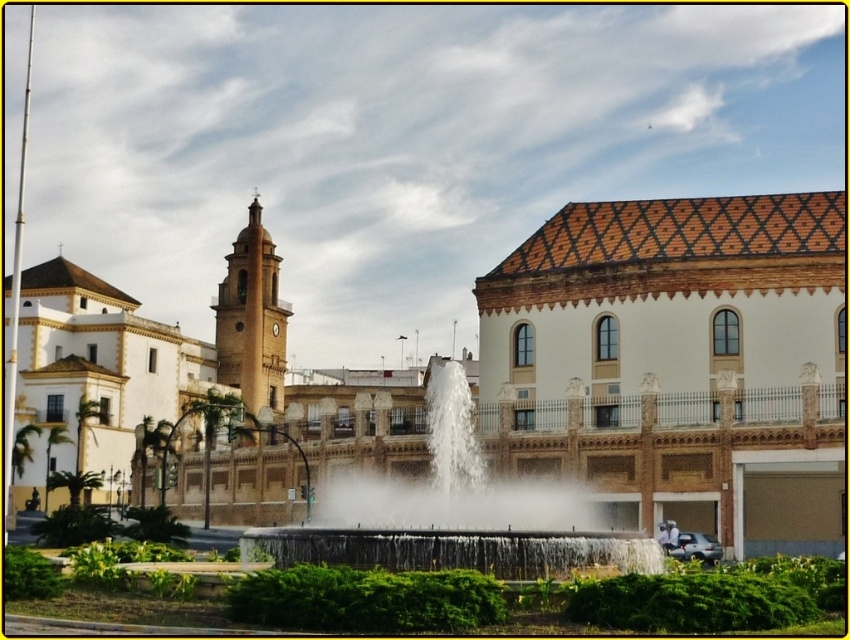
Question: Estimate the real-world distances between objects in this image. Which object is closer to the white stone fountain at center?

Choices:
 (A) white textured fountain at center
 (B) terracotta tiled palace at right

Answer: (B)

Question: Does white textured fountain at center appear over terracotta tiled palace at right?

Choices:
 (A) yes
 (B) no

Answer: (B)

Question: Which object appears closest to the camera in this image?

Choices:
 (A) terracotta tiled palace at right
 (B) white stone fountain at center

Answer: (B)

Question: Is the position of terracotta tiled palace at right more distant than that of white stone fountain at center?

Choices:
 (A) no
 (B) yes

Answer: (B)

Question: Can you confirm if white textured fountain at center is smaller than terracotta tiled palace at right?

Choices:
 (A) no
 (B) yes

Answer: (A)

Question: Among these points, which one is farthest from the camera?

Choices:
 (A) (796, 404)
 (B) (388, 508)
 (C) (777, 381)

Answer: (C)